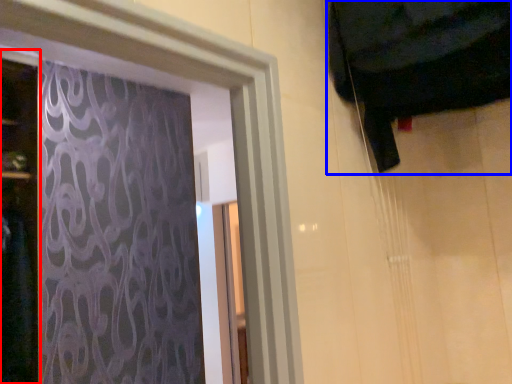
Question: Which object appears closest to the camera in this image, door (highlighted by a red box) or curtain (highlighted by a blue box)?

Choices:
 (A) door
 (B) curtain

Answer: (B)